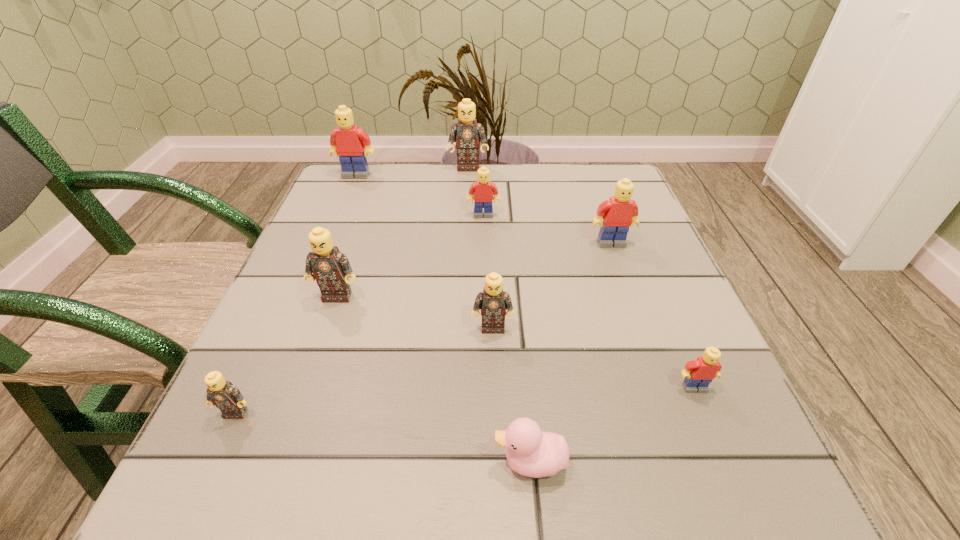
Locate an element on the screen. the third farthest tan Lego is located at coordinates (493, 302).

The image size is (960, 540). In order to click on the smallest yellow Lego in this screenshot , I will do `click(699, 373)`.

Where is `the seventh farthest Lego`? This screenshot has height=540, width=960. the seventh farthest Lego is located at coordinates [x=699, y=373].

In order to click on the leftmost tan Lego in this screenshot , I will do `click(227, 397)`.

Image resolution: width=960 pixels, height=540 pixels. In order to click on the nearest tan Lego in this screenshot , I will do `click(227, 397)`.

Identify the location of duckling. (531, 452).

At what (x,y) coordinates should I click in order to perform the action: click on pink duckling. Please return your answer as a coordinate pair (x, y). The height and width of the screenshot is (540, 960). Looking at the image, I should click on (531, 452).

Identify the location of free region located 0.290m on the front-facing side of the biggest yellow Lego. coord(324,250).

The height and width of the screenshot is (540, 960). I want to click on blank space located in front of the farthest tan Lego, so pos(467,196).

The height and width of the screenshot is (540, 960). Find the location of `vacant point located 0.070m on the front-facing side of the fifth nearest Lego`. vacant point located 0.070m on the front-facing side of the fifth nearest Lego is located at coordinates (621, 270).